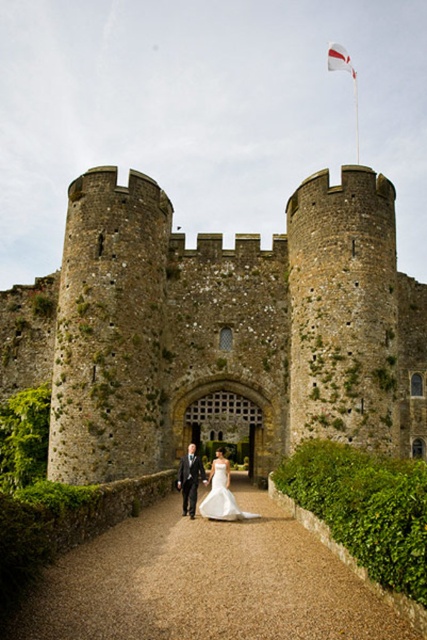
Between white satin dress at center and white fabric flag at upper center, which one is positioned lower?

white satin dress at center

Measure the distance between white satin dress at center and camera.

The distance of white satin dress at center from camera is 174.51 feet.

Locate an element on the screen. white satin dress at center is located at coordinates (190, 480).

The width and height of the screenshot is (427, 640). I want to click on white satin wedding dress at center, so click(222, 493).

Who is more forward, (231, 500) or (189, 486)?

Point (231, 500) is more forward.

In order to click on white satin wedding dress at center in this screenshot , I will do `click(222, 493)`.

Is stone textured castle at center to the left of brown gravel path at center from the viewer's perspective?

Correct, you'll find stone textured castle at center to the left of brown gravel path at center.

Is stone textured castle at center wider than brown gravel path at center?

Correct, the width of stone textured castle at center exceeds that of brown gravel path at center.

Does point (307, 248) lie behind point (132, 627)?

Yes, it is.

Identify the location of stone textured castle at center. (219, 326).